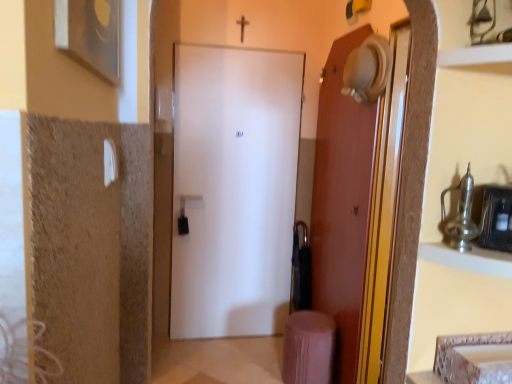
Question: Does pink fabric stool at lower right have a larger size compared to metallic silver cabinet at upper right?

Choices:
 (A) no
 (B) yes

Answer: (B)

Question: Would you consider pink fabric stool at lower right to be distant from metallic silver cabinet at upper right?

Choices:
 (A) yes
 (B) no

Answer: (A)

Question: Can you confirm if pink fabric stool at lower right is smaller than metallic silver cabinet at upper right?

Choices:
 (A) yes
 (B) no

Answer: (B)

Question: From the image's perspective, is pink fabric stool at lower right under metallic silver cabinet at upper right?

Choices:
 (A) no
 (B) yes

Answer: (B)

Question: From a real-world perspective, is pink fabric stool at lower right below metallic silver cabinet at upper right?

Choices:
 (A) yes
 (B) no

Answer: (A)

Question: Based on their positions, is pink fabric stool at lower right located to the left or right of metallic silver shelf at upper right?

Choices:
 (A) right
 (B) left

Answer: (B)

Question: From their relative heights in the image, would you say pink fabric stool at lower right is taller or shorter than metallic silver shelf at upper right?

Choices:
 (A) short
 (B) tall

Answer: (B)

Question: From the image's perspective, is pink fabric stool at lower right located above or below metallic silver shelf at upper right?

Choices:
 (A) above
 (B) below

Answer: (B)

Question: Is point (291, 357) closer or farther from the camera than point (480, 57)?

Choices:
 (A) closer
 (B) farther

Answer: (B)

Question: From their relative heights in the image, would you say metallic silver medicine cabinet at right is taller or shorter than metallic silver cabinet at upper right?

Choices:
 (A) short
 (B) tall

Answer: (B)

Question: Do you think metallic silver medicine cabinet at right is within metallic silver cabinet at upper right, or outside of it?

Choices:
 (A) outside
 (B) inside

Answer: (A)

Question: Does point (488, 210) appear closer or farther from the camera than point (483, 249)?

Choices:
 (A) farther
 (B) closer

Answer: (B)

Question: Is metallic silver medicine cabinet at right in front of or behind metallic silver cabinet at upper right in the image?

Choices:
 (A) behind
 (B) front

Answer: (A)

Question: Is metallic silver cabinet at upper right in front of or behind pink fabric stool at lower right in the image?

Choices:
 (A) front
 (B) behind

Answer: (A)

Question: Is metallic silver cabinet at upper right to the left or to the right of pink fabric stool at lower right in the image?

Choices:
 (A) right
 (B) left

Answer: (A)